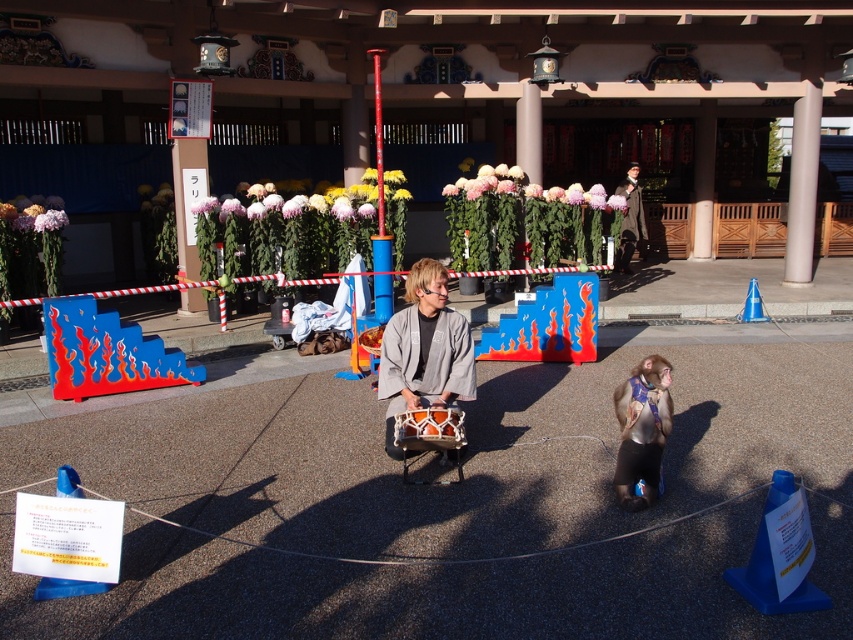
You are an event organizer planning to place a decorative banner between the gray fabric kimono at center and the orange glossy drum at center. Since you want the banner to be visible from both sides, should you place it closer to the larger object or the smaller one?

The gray fabric kimono at center is larger than the orange glossy drum at center. To ensure the banner is visible from both sides, place it closer to the smaller orange glossy drum at center so it doesn not block the view of the larger kimono.

In the scene shown: You are a photographer at the event and want to capture both the metallic silver monkey at center and the dark brown leather jacket at upper center in the same frame. Which object should you focus on first to ensure both are in the frame?

The metallic silver monkey at center is not as tall as the dark brown leather jacket at upper center, so you should focus on the dark brown leather jacket at upper center first to ensure both are in the frame.